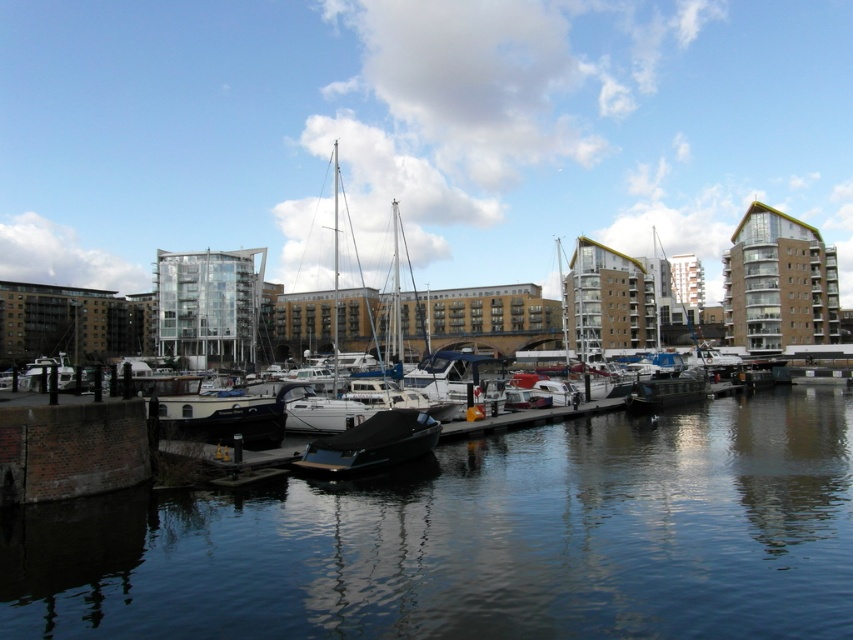
Which of these two, smooth dark water at center or shiny black boat at center, stands taller?

With more height is shiny black boat at center.

This screenshot has width=853, height=640. I want to click on smooth dark water at center, so click(479, 540).